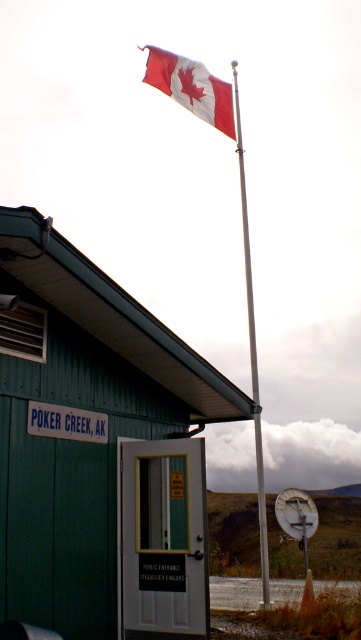
You are standing in front of the green wood cabin at center and looking towards the silver metallic flag pole at center. Which object is taller?

The silver metallic flag pole at center is taller than the green wood cabin at center.

You are standing at the point with coordinates 0.5, 0.5. You want to walk to the green wood cabin at center. In which direction should you walk?

The green wood cabin at center is located at point (80,420). Since you are at (180,320), you should walk southwest to reach it.

You are a photographer trying to capture the green wood cabin at center and the red and white fabric flag at upper center in a single shot. Based on their widths, which object will appear narrower in the photo?

The green wood cabin at center is thinner than the red and white fabric flag at upper center, so it will appear narrower in the photo.